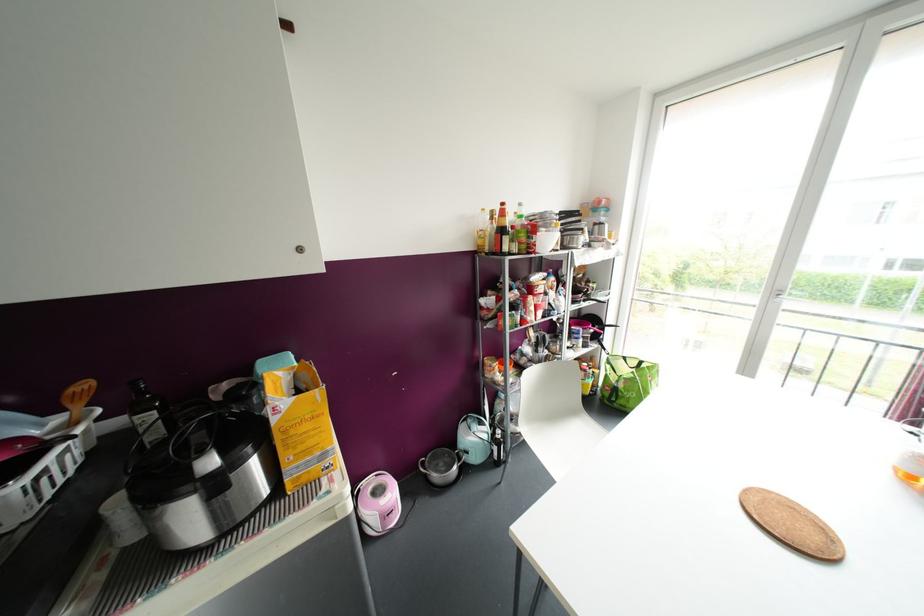
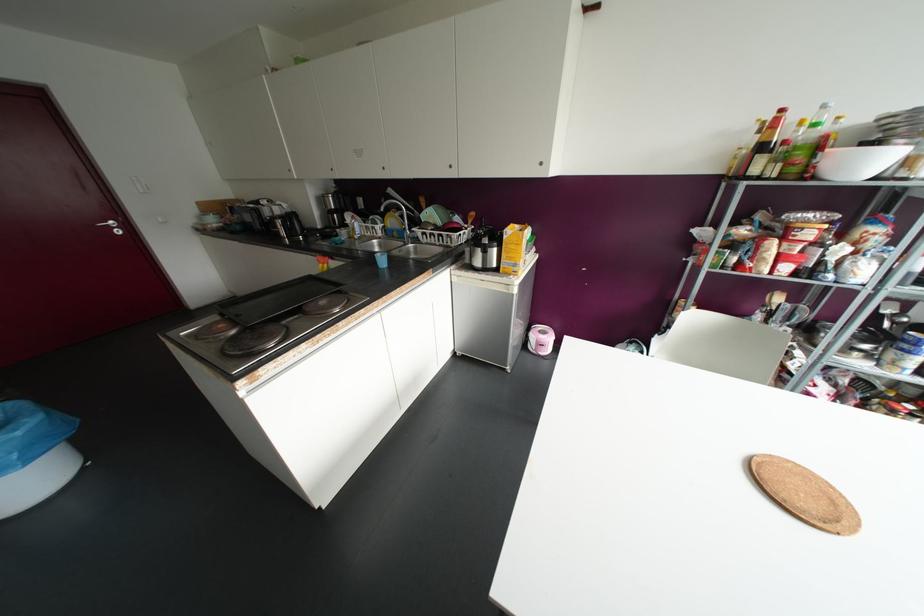
The point at (518, 204) is marked in the first image. Where is the corresponding point in the second image?

(823, 106)